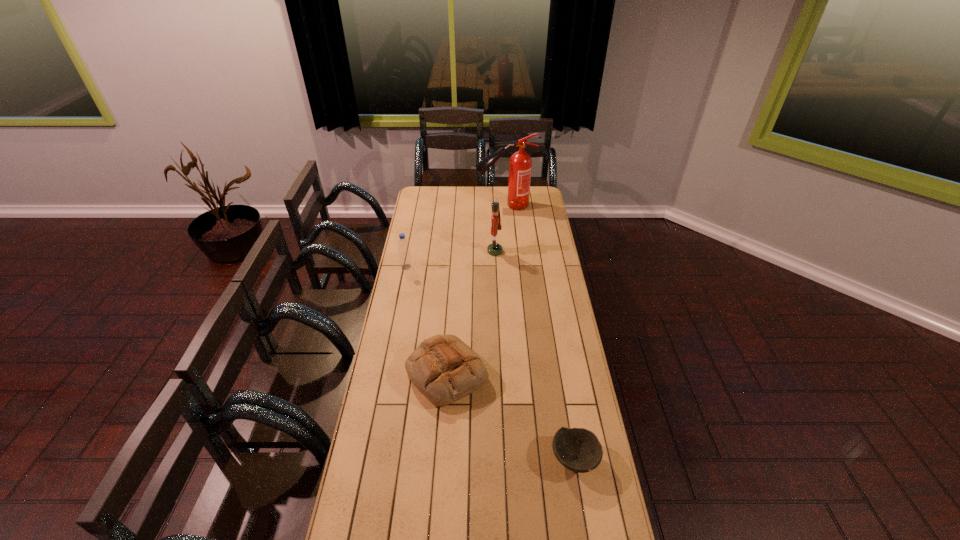
This screenshot has width=960, height=540. In order to click on fire extinguisher in this screenshot , I will do `click(520, 163)`.

The width and height of the screenshot is (960, 540). In order to click on the farthest object in this screenshot , I will do `click(520, 163)`.

The image size is (960, 540). Identify the location of nutcracker. (494, 249).

You are a GUI agent. You are given a task and a screenshot of the screen. Output one action in this format:
    pyautogui.click(x=<x>, y=<y>)
    Task: Click on the fourth shortest object
    
    Given the screenshot: What is the action you would take?
    pyautogui.click(x=494, y=249)

What are the coordinates of `bottle` in the screenshot? It's located at (405, 261).

Identify the location of the leftmost object. (405, 261).

I want to click on the second nearest object, so click(443, 368).

Locate an element on the screen. This screenshot has height=540, width=960. bread is located at coordinates (443, 368).

Where is `the nearest object`? This screenshot has height=540, width=960. the nearest object is located at coordinates point(579,450).

Identify the location of the shortest object. (579, 450).